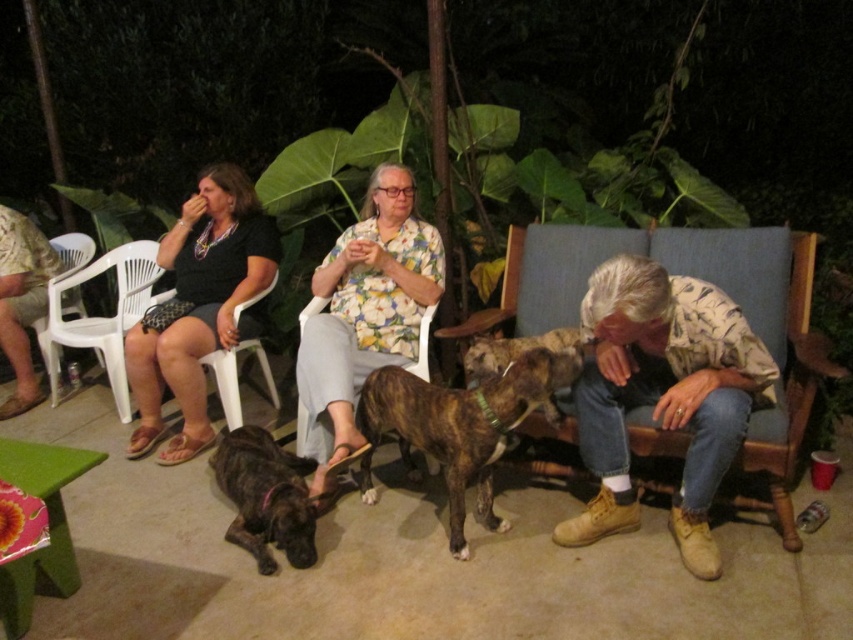
Is matte black shirt at left bigger than white plastic chair at lower left?

Yes, matte black shirt at left is bigger than white plastic chair at lower left.

Which is behind, point (219, 214) or point (88, 250)?

The point (88, 250) is more distant.

The image size is (853, 640). I want to click on matte black shirt at left, so pos(199,307).

Can you confirm if wooden rocking chair at center is shorter than braided fur dog at lower center?

Incorrect, wooden rocking chair at center's height does not fall short of braided fur dog at lower center's.

Which is more to the left, wooden rocking chair at center or braided fur dog at lower center?

Positioned to the left is braided fur dog at lower center.

Does point (642, 442) come closer to viewer compared to point (529, 346)?

Yes, it is in front of point (529, 346).

Identify the location of wooden rocking chair at center. (791, 378).

What do you see at coordinates (663, 396) in the screenshot? Image resolution: width=853 pixels, height=640 pixels. I see `leather boots at lower right` at bounding box center [663, 396].

Which is in front, point (567, 547) or point (41, 232)?

Point (567, 547) is in front.

Who is more distant from viewer, (653,312) or (0,339)?

Point (0,339)

Locate an element on the screen. The image size is (853, 640). leather boots at lower right is located at coordinates (663, 396).